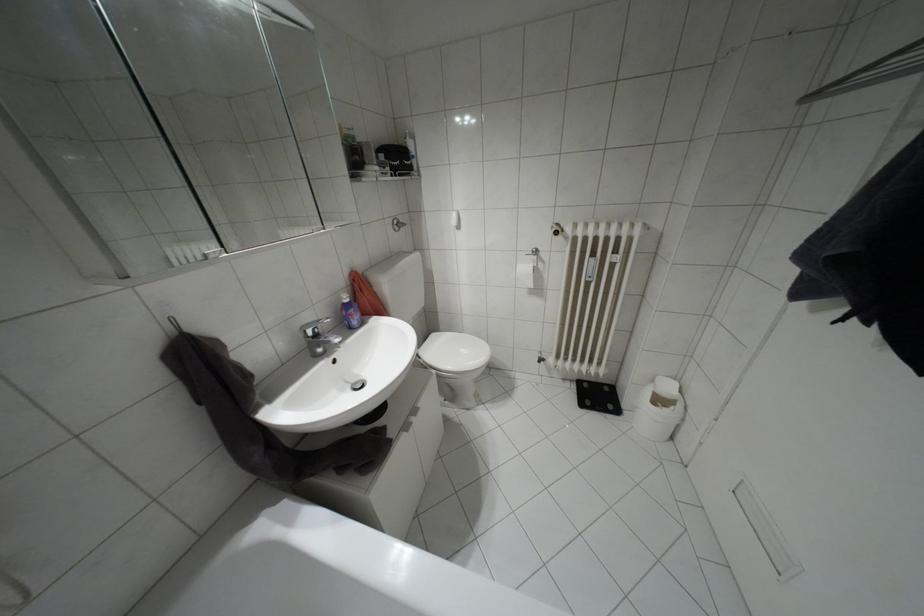
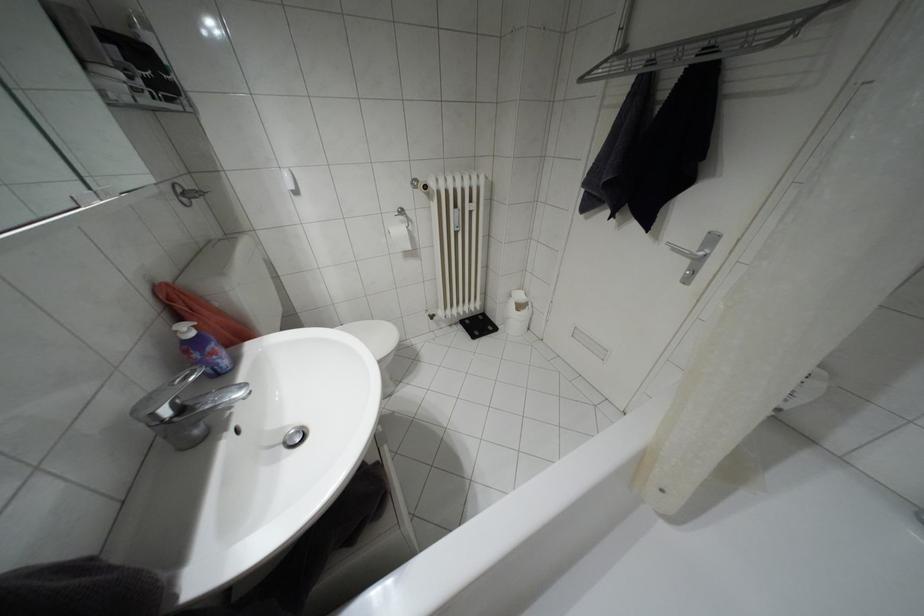
In the second image, find the point that corresponds to point 666,387 in the first image.

(518, 296)